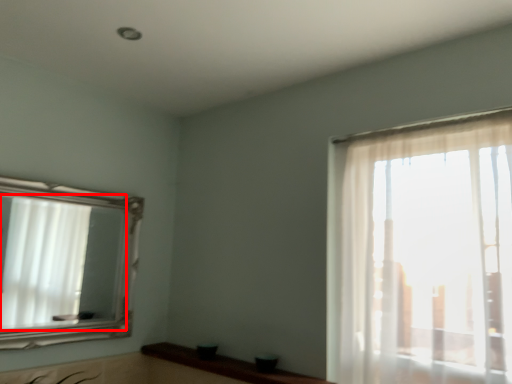
Question: Observing the image, what is the correct spatial positioning of mirror (annotated by the red box) in reference to counter top?

Choices:
 (A) left
 (B) right

Answer: (A)